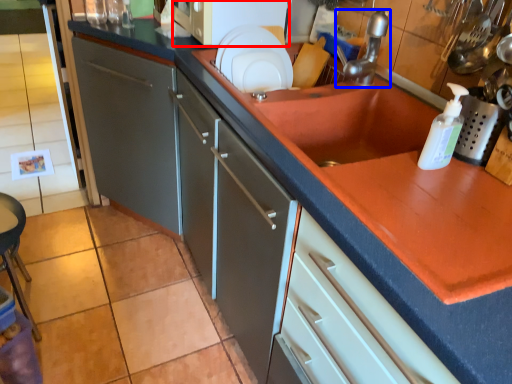
Question: Which point is further to the camera, microwave (highlighted by a red box) or tap (highlighted by a blue box)?

Choices:
 (A) microwave
 (B) tap

Answer: (A)